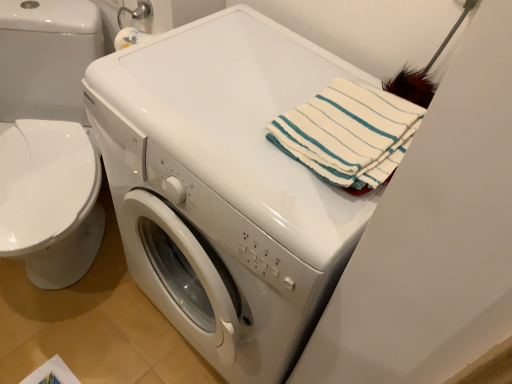
Question: Visually, is white glossy washer at left positioned to the left or to the right of white striped towel at upper right?

Choices:
 (A) left
 (B) right

Answer: (A)

Question: Which is correct: white glossy washer at left is inside white striped towel at upper right, or outside of it?

Choices:
 (A) outside
 (B) inside

Answer: (A)

Question: Estimate the real-world distances between objects in this image. Which object is closer to the white glossy washing machine at center?

Choices:
 (A) white glossy washer at left
 (B) white striped towel at upper right

Answer: (B)

Question: Which of these objects is positioned closest to the white glossy washer at left?

Choices:
 (A) white striped towel at upper right
 (B) white glossy washing machine at center

Answer: (B)